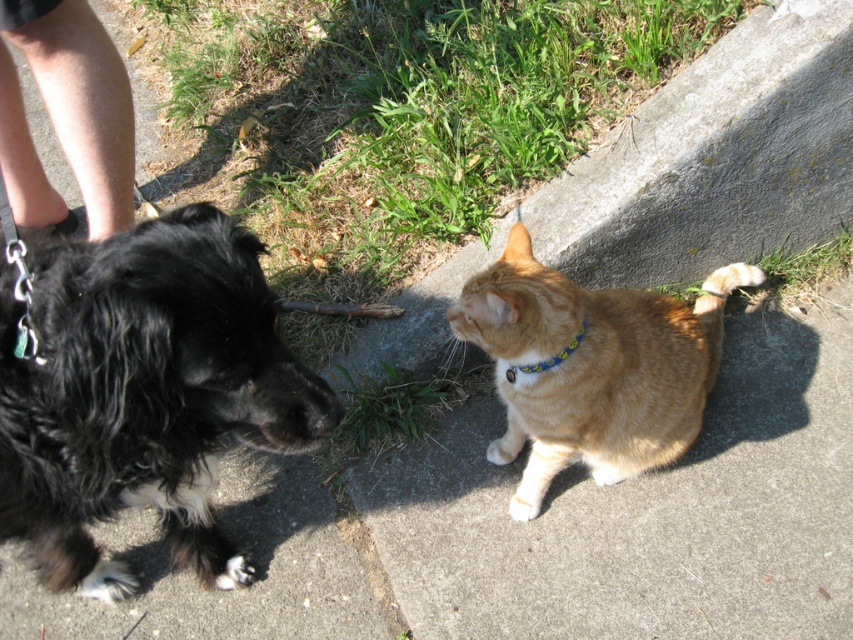
You are a photographer trying to capture a photo of the orange fur cat at center and the blue fabric neckband at center. Based on their positions, which one should you focus on first to ensure both are in the frame?

The orange fur cat at center is located below the blue fabric neckband at center, so you should focus on the blue fabric neckband at center first to ensure both are in the frame.

You are a delivery robot that needs to move from the black fluffy dog at left to the blue fabric neckband at center. Is the path between them clear?

The black fluffy dog at left is in front of the blue fabric neckband at center, so the path between them is blocked by the dog itself.

You are a photographer trying to capture a clear shot of the orange fur cat at center and the blue fabric neckband at center. Since you want both subjects to be in focus, you need to know their distance from each other. Can you determine if they are close enough for the camera to focus on both at the same time?

The orange fur cat at center is in front of the blue fabric neckband at center, so they are positioned at different distances. This means the camera might struggle to keep both in focus simultaneously as they are not at the same plane.